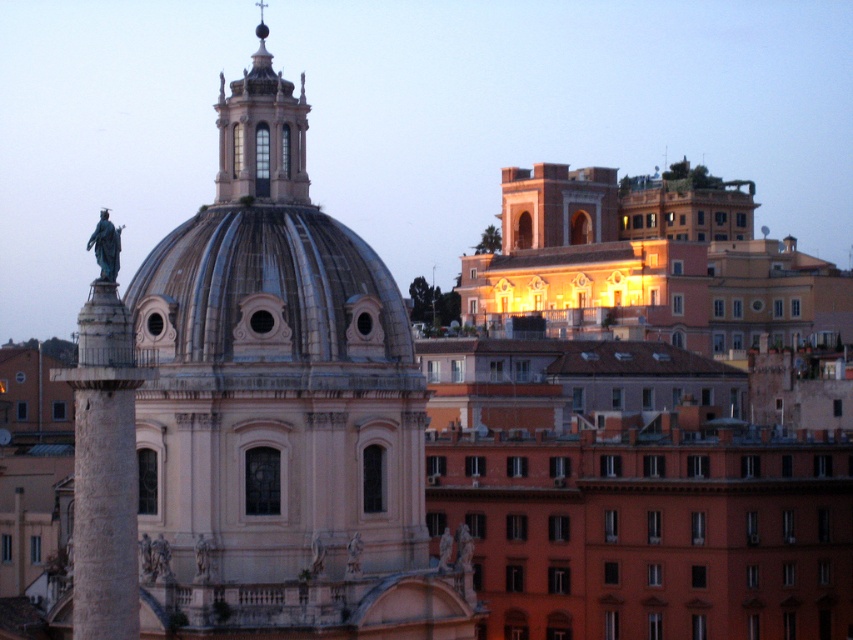
You are a city planner assessing the urban layout. Given the distance between the matte orange building at upper right and the stone column at left, would a pedestrian need to walk more than 70 meters to travel between them? Please answer based on the provided information.

The distance between the matte orange building at upper right and the stone column at left is 72.15 meters, so yes, a pedestrian would need to walk more than 70 meters to travel between them.

You are an architect analyzing the spatial arrangement of the urban scene. Given that you need to place a new sculpture between the matte orange building at upper right and the stone column at left, which object should the sculpture be closer to to maintain visual balance?

The sculpture should be placed closer to the stone column at left because the matte orange building at upper right is closer to the viewer, so balancing it with the column further back would create equilibrium in the composition.

Looking at this image, you are an architect analyzing the layout of this urban area. Based on the scene, which object is positioned to the right of the other between the shiny metallic dome at center and the stone column at left?

The shiny metallic dome at center is to the right of the stone column at left, so the dome is positioned to the right of the column.